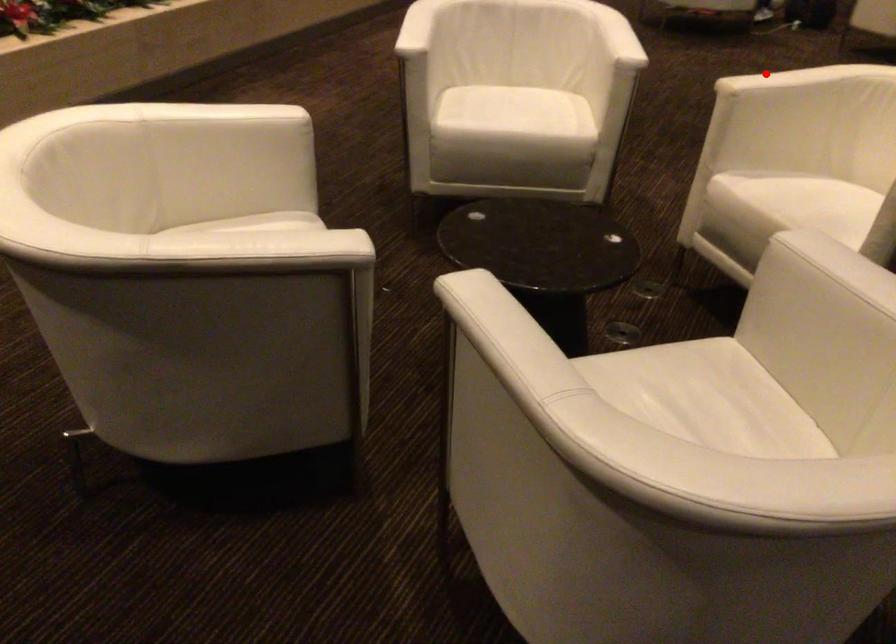
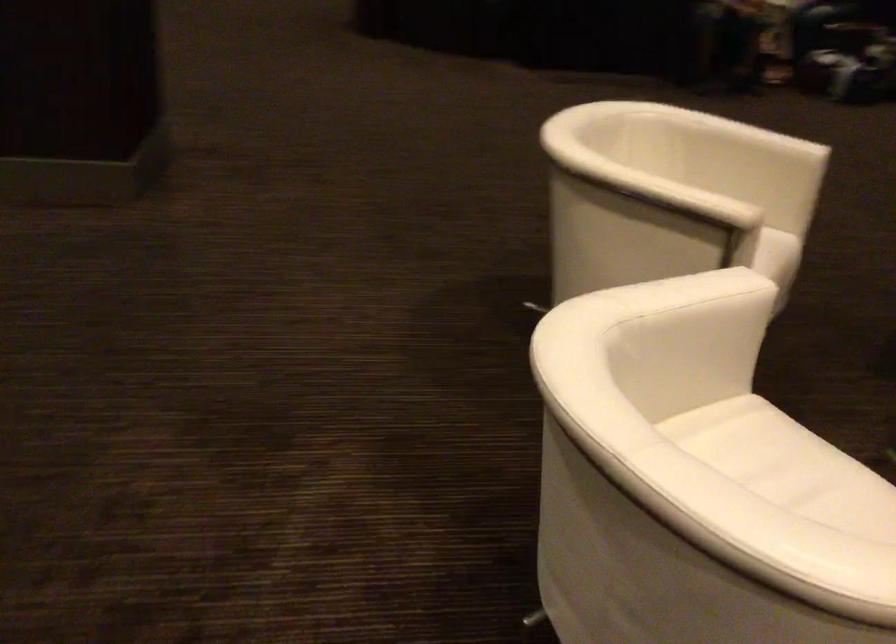
Question: I am providing you with two images of the same scene from different viewpoints. A red point is marked on the first image. At the location where the point appears in image 1, is it still visible in image 2?

Choices:
 (A) Yes
 (B) No

Answer: (A)